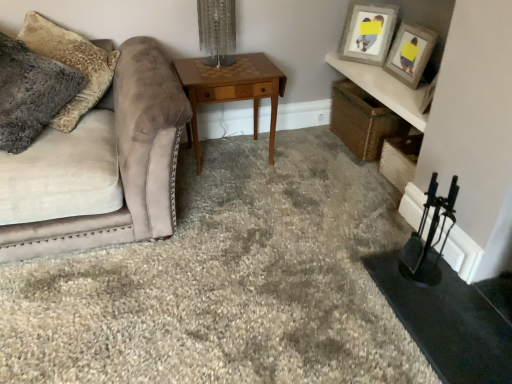
Image resolution: width=512 pixels, height=384 pixels. I want to click on vacant area located to the right-hand side of woodenobject at center, so click(305, 165).